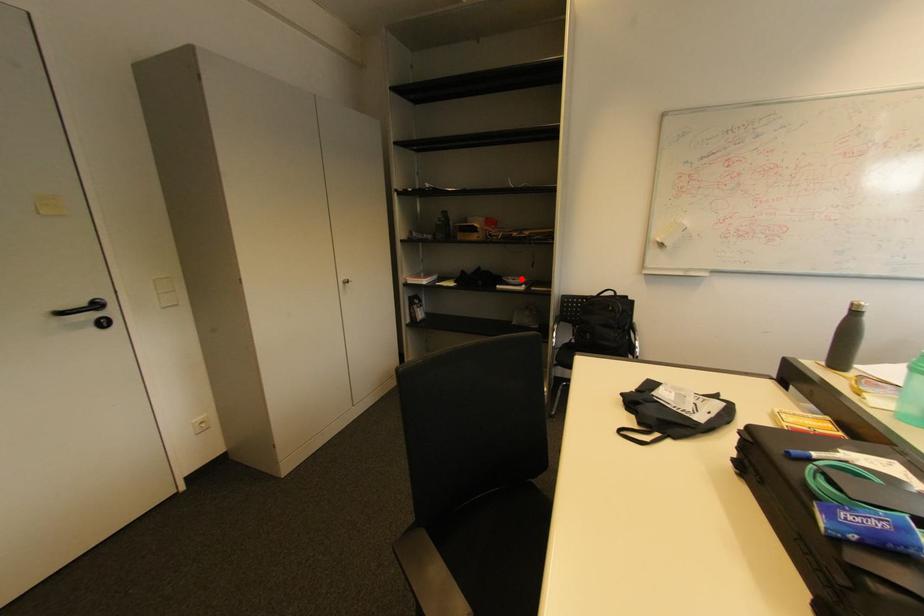
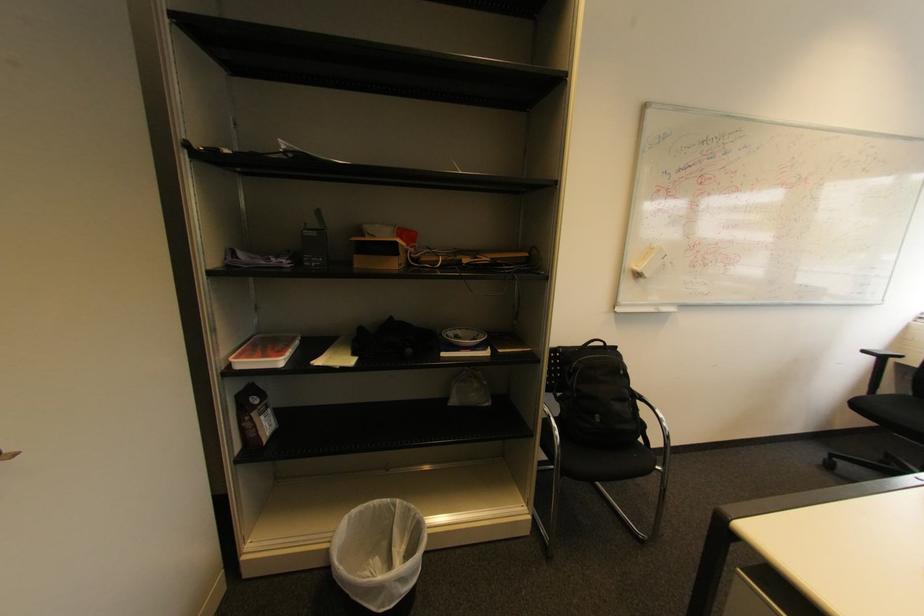
In the second image, find the point that corresponds to the highlighted location in the first image.

(464, 333)